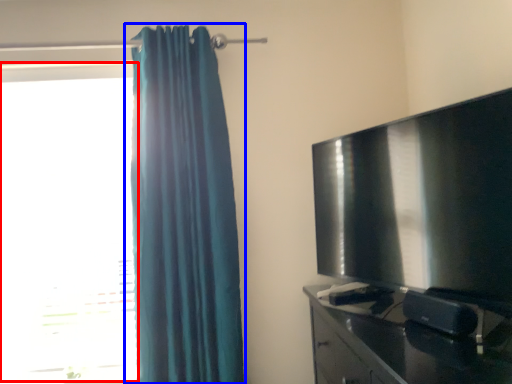
Question: Which object appears farthest to the camera in this image, window (highlighted by a red box) or curtain (highlighted by a blue box)?

Choices:
 (A) window
 (B) curtain

Answer: (A)